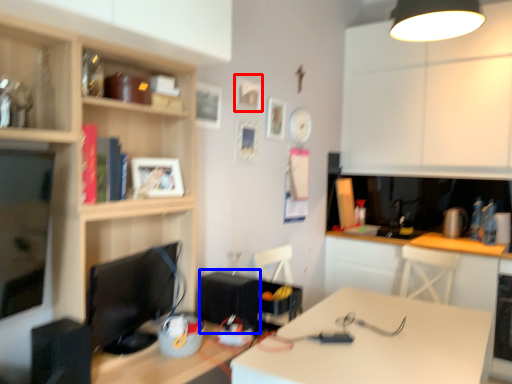
Question: Which object appears closest to the camera in this image, picture frame (highlighted by a red box) or appliance (highlighted by a blue box)?

Choices:
 (A) picture frame
 (B) appliance

Answer: (B)